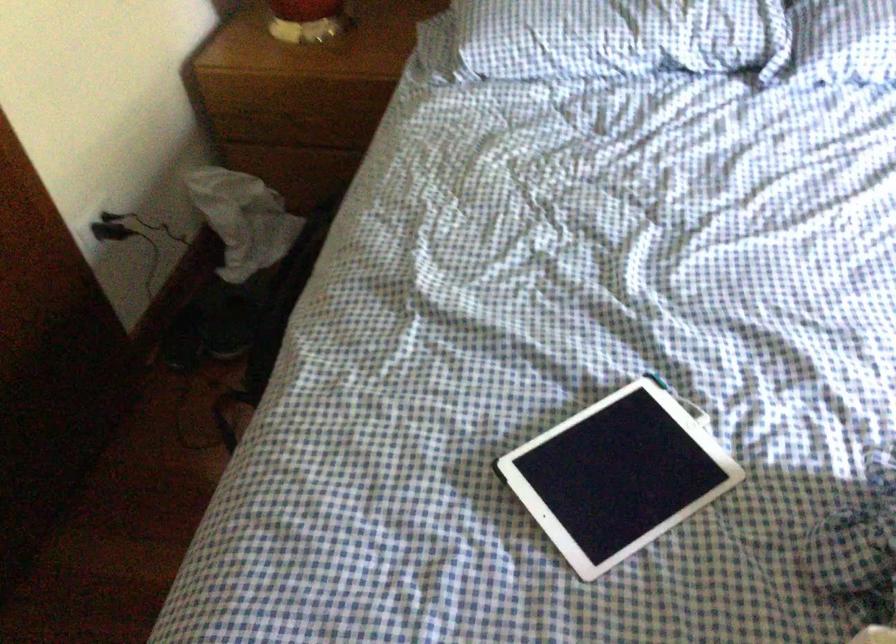
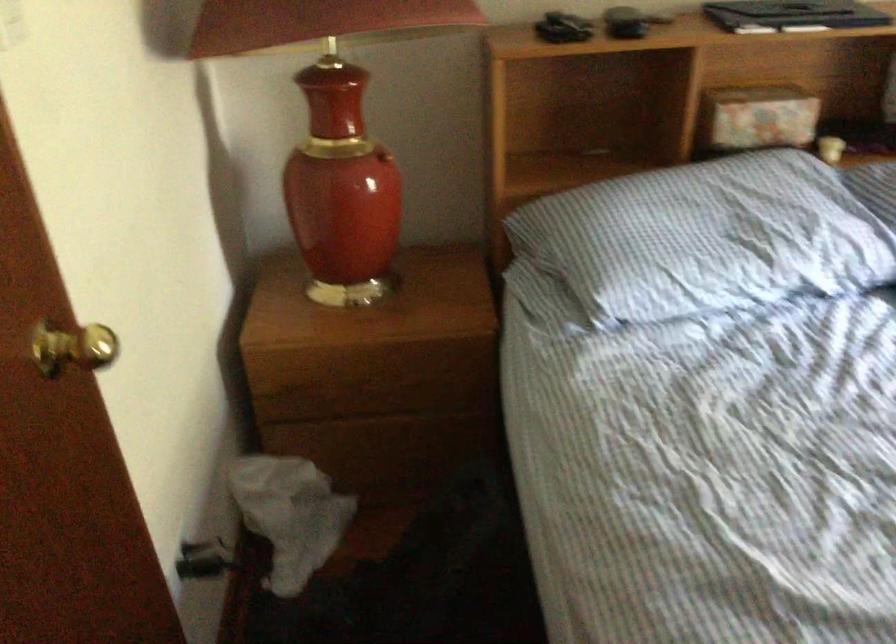
In the second image, find the point that corresponds to point 140,232 in the first image.

(204, 560)